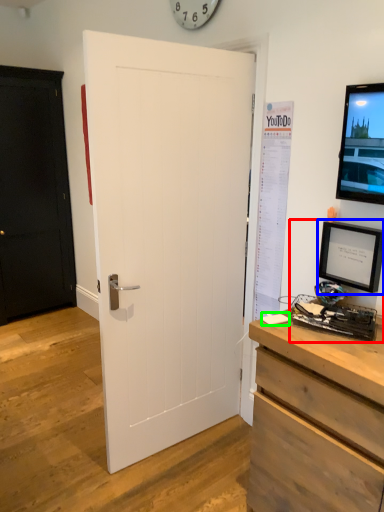
Question: Which object is the farthest from desktop computer (highlighted by a red box)? Choose among these: picture frame (highlighted by a blue box) or notepad (highlighted by a green box).

Choices:
 (A) picture frame
 (B) notepad

Answer: (B)